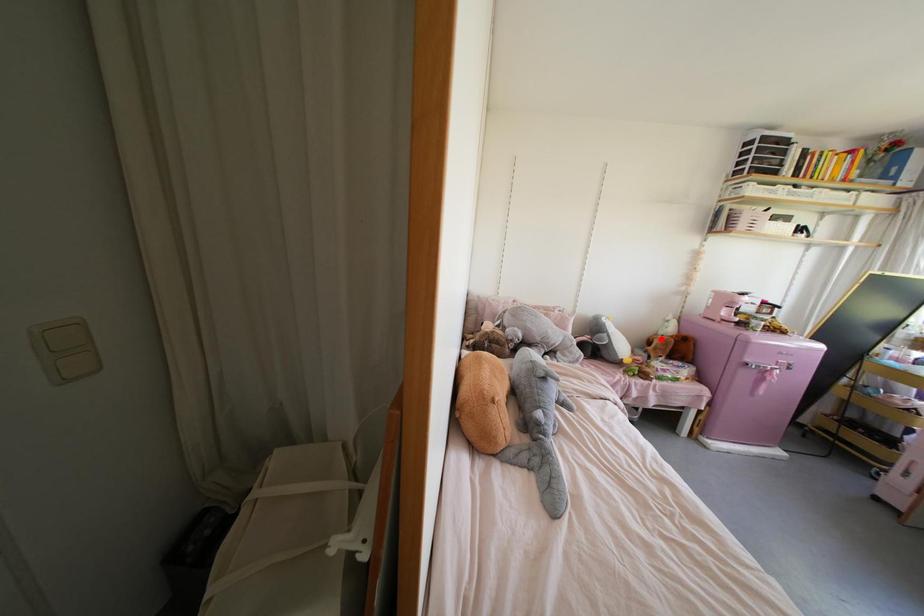
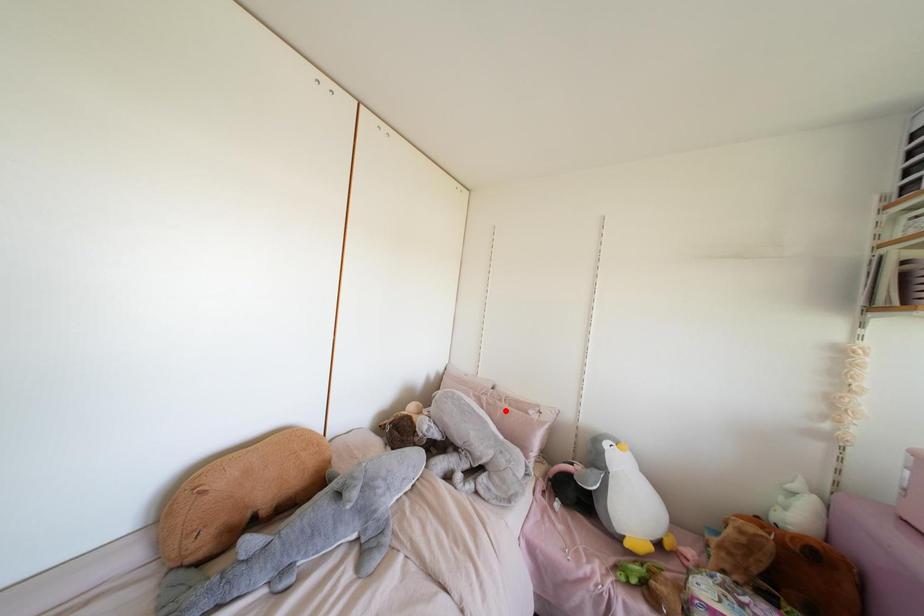
I am providing you with two images of the same scene from different viewpoints. A red point is marked on the first image and another point is marked on the second image. Does the point marked in image1 correspond to the same location as the one in image2?

No